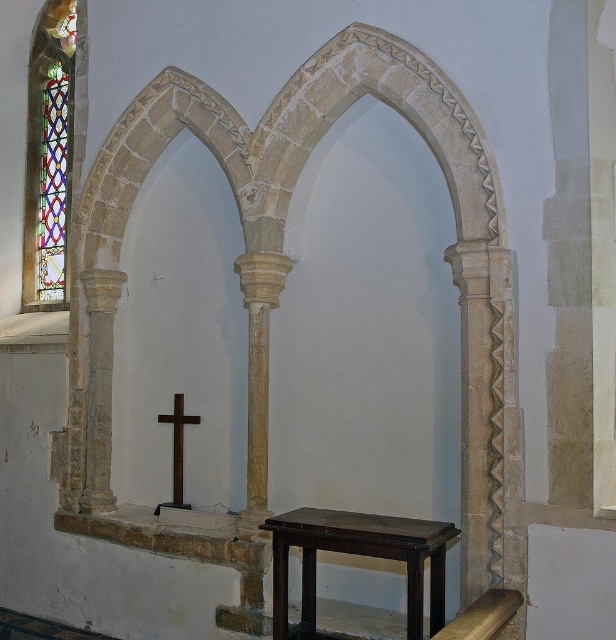
You are a visitor standing at the entrance of the church. You see a dark brown wooden table at center and a dark brown wooden cross at center. Which object is closer to you?

The dark brown wooden table at center is closer to you because it is in front of the dark brown wooden cross at center.

From the picture: You are standing in the church and want to determine which of the two points, point (41, 291) or point (180, 444), is closer to you. Based on the image, which one is nearer?

Point (41, 291) is closer to you because it is further to the viewer than point (180, 444).

You are an interior designer planning to place a new statue that is 1.2 meters tall in the church. The statue must be placed on the dark brown wooden table at center so it can be seen from the stained glass window. Will the combined height of the table and the statue exceed the height of the dark brown wooden cross at center?

The dark brown wooden table at center has a lesser height compared to the dark brown wooden cross at center. Since the table is shorter than the cross, adding the 1.2 meter statue on top of it may or may not exceed the cross height depending on the table and statue combined height. However, since the cross is taller than the table alone, there is a possibility that the total height could surpass it if the statue adds enough height. Without exact measurements, we can infer that the cross is taller than the 1